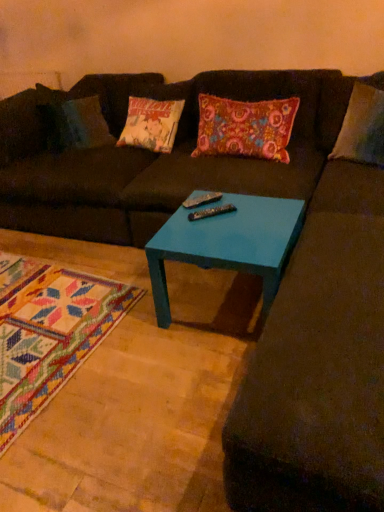
The width and height of the screenshot is (384, 512). What are the coordinates of `free space in front of teal glossy table at center` in the screenshot? It's located at pyautogui.click(x=188, y=387).